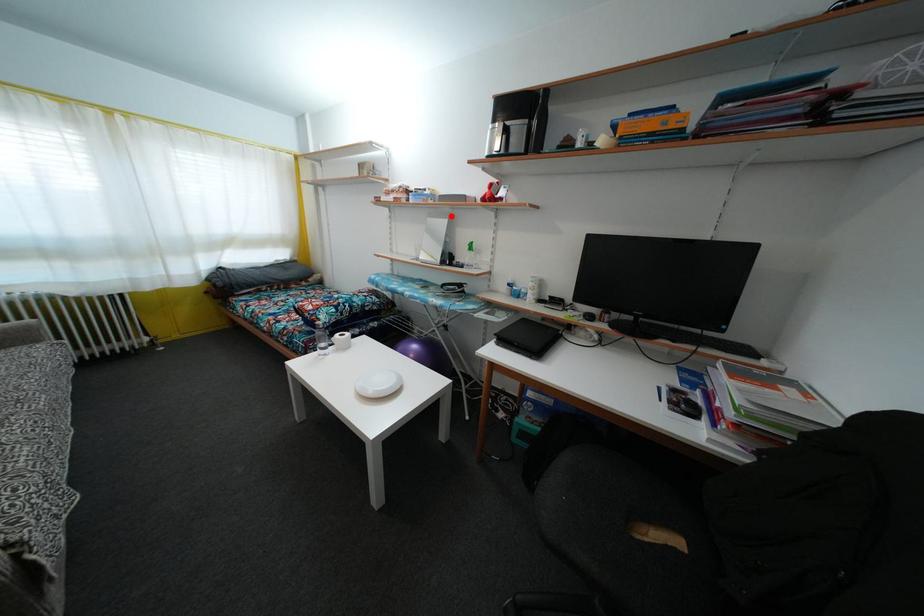
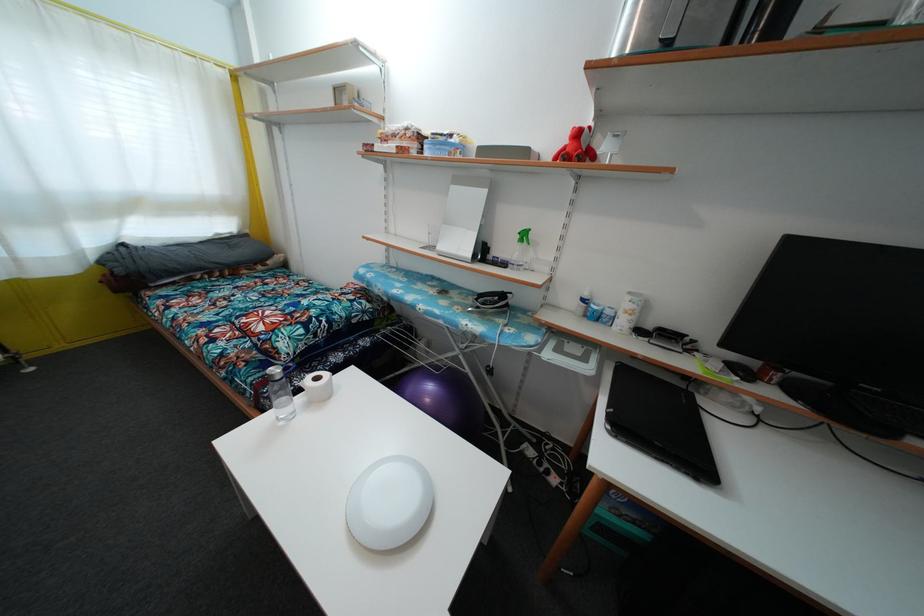
The point at the highlighted location is marked in the first image. Where is the corresponding point in the second image?

(488, 177)